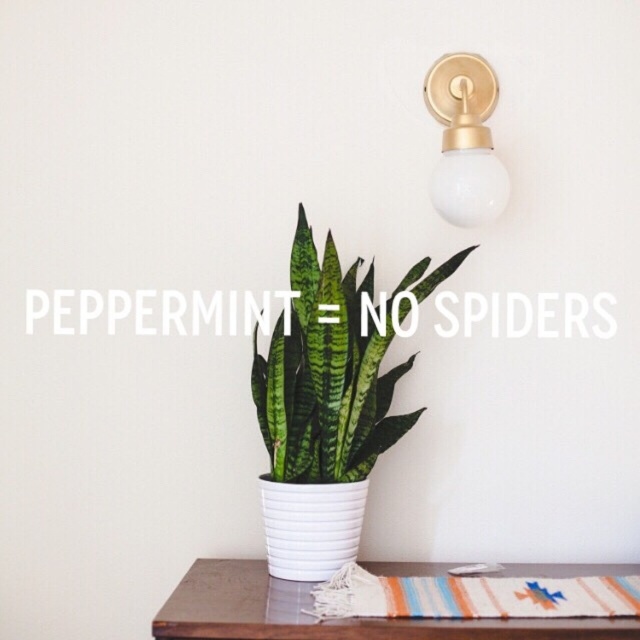
You are organizing a small indoor garden and have limited space. You need to place the green glossy snake plant at center on a shelf that can only accommodate items narrower than the brown wooden table at lower center. Will the snake plant fit on the shelf?

The green glossy snake plant at center is thinner than the brown wooden table at lower center, so it will fit on the shelf since it is narrower than the table.

Looking at this image, you are arranging a small potted herb on the brown wooden table at lower center. The green glossy snake plant at center is currently blocking the space where you want to place it. Can you move the plant to the side to make room?

The green glossy snake plant at center is located above the brown wooden table at lower center, so it is already positioned in a way that it might not be resting directly on the table. You might need to check its placement to see if it can be moved aside.